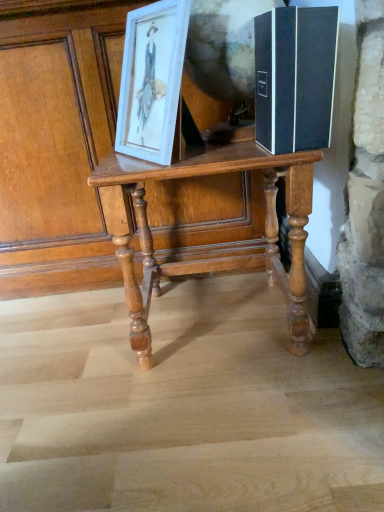
Question: Is white wood picture frame at upper left behind black matte book at right?

Choices:
 (A) no
 (B) yes

Answer: (B)

Question: From the image's perspective, is white wood picture frame at upper left on black matte book at right?

Choices:
 (A) yes
 (B) no

Answer: (A)

Question: Can we say white wood picture frame at upper left lies outside black matte book at right?

Choices:
 (A) no
 (B) yes

Answer: (B)

Question: Is white wood picture frame at upper left facing towards black matte book at right?

Choices:
 (A) no
 (B) yes

Answer: (A)

Question: From a real-world perspective, is white wood picture frame at upper left on top of black matte book at right?

Choices:
 (A) no
 (B) yes

Answer: (B)

Question: Is white wood picture frame at upper left facing away from black matte book at right?

Choices:
 (A) no
 (B) yes

Answer: (A)

Question: Is wooden table at center shorter than black matte book at right?

Choices:
 (A) no
 (B) yes

Answer: (A)

Question: From the image's perspective, does wooden table at center appear lower than black matte book at right?

Choices:
 (A) no
 (B) yes

Answer: (B)

Question: Would you say wooden table at center is a long distance from black matte book at right?

Choices:
 (A) yes
 (B) no

Answer: (B)

Question: Is wooden table at center positioned before black matte book at right?

Choices:
 (A) no
 (B) yes

Answer: (A)

Question: From a real-world perspective, does wooden table at center sit lower than black matte book at right?

Choices:
 (A) yes
 (B) no

Answer: (A)

Question: Does wooden table at center have a larger size compared to black matte book at right?

Choices:
 (A) yes
 (B) no

Answer: (A)

Question: Can you confirm if black matte book at right is taller than wooden table at center?

Choices:
 (A) yes
 (B) no

Answer: (B)